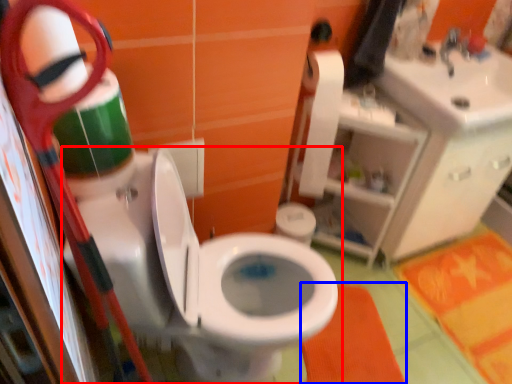
Question: Which object appears farthest to the camera in this image, toilet (highlighted by a red box) or bath mat (highlighted by a blue box)?

Choices:
 (A) toilet
 (B) bath mat

Answer: (B)